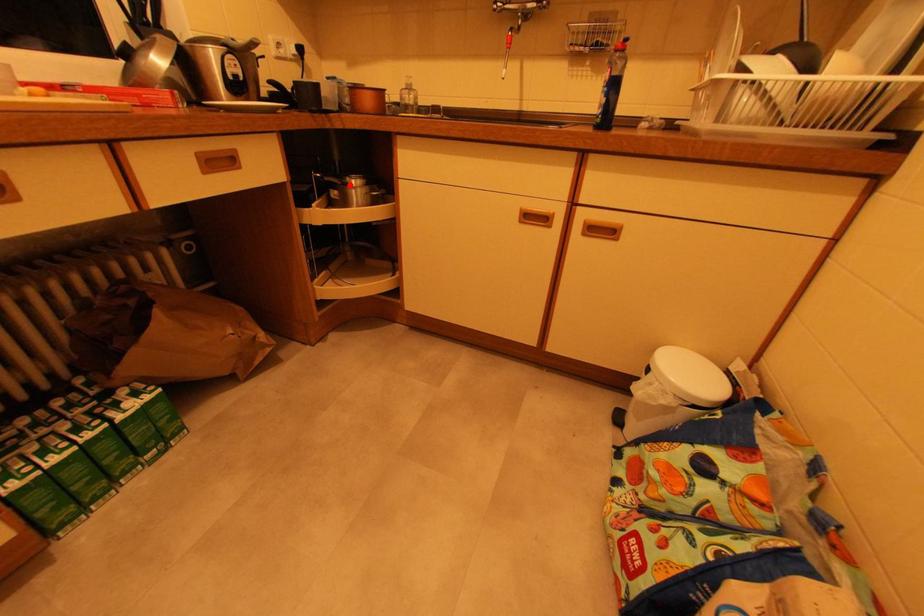
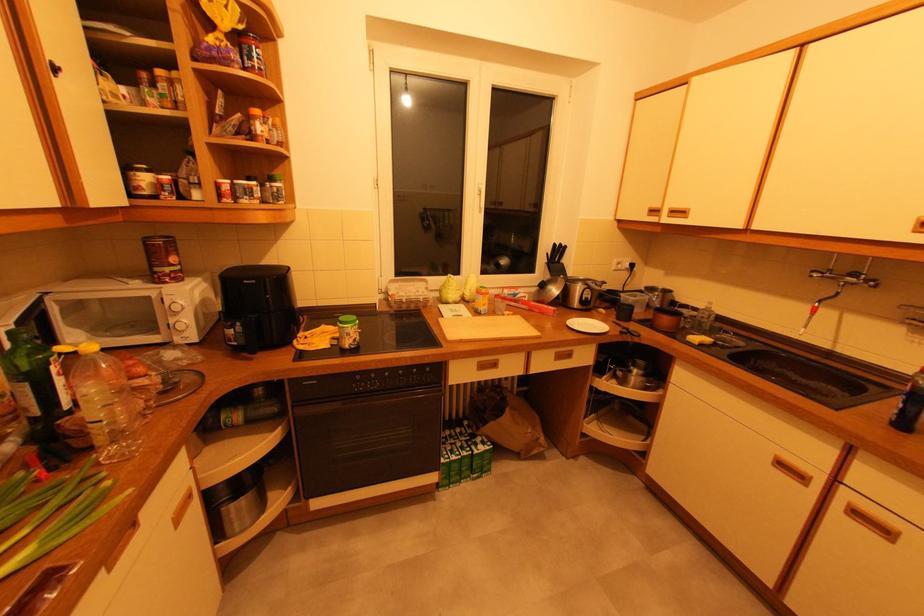
Where in the second image is the point corresponding to the highlighted location from the first image?

(634, 371)